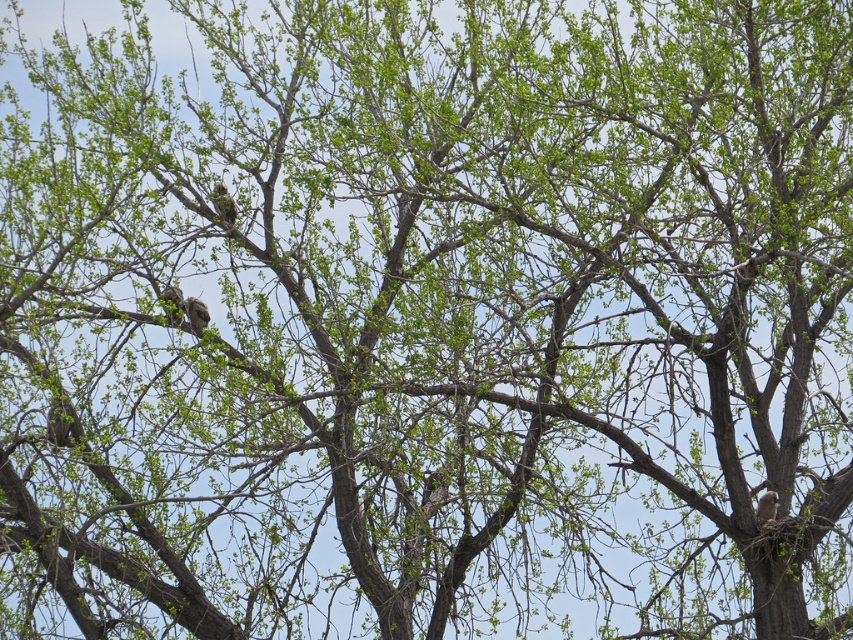
You are an ornithologist observing two birds on a tree. You notice a green textured bird at center and a brown speckled feathers at center. Which bird is taller?

The green textured bird at center is taller than the brown speckled feathers at center according to the description.

You are an ornithologist observing this tree. You notice two birds at the center of the image. Which bird is closer to you, the green textured bird at center or the brown feathered owl at center?

The green textured bird at center is closer to you because the brown feathered owl at center is behind it.